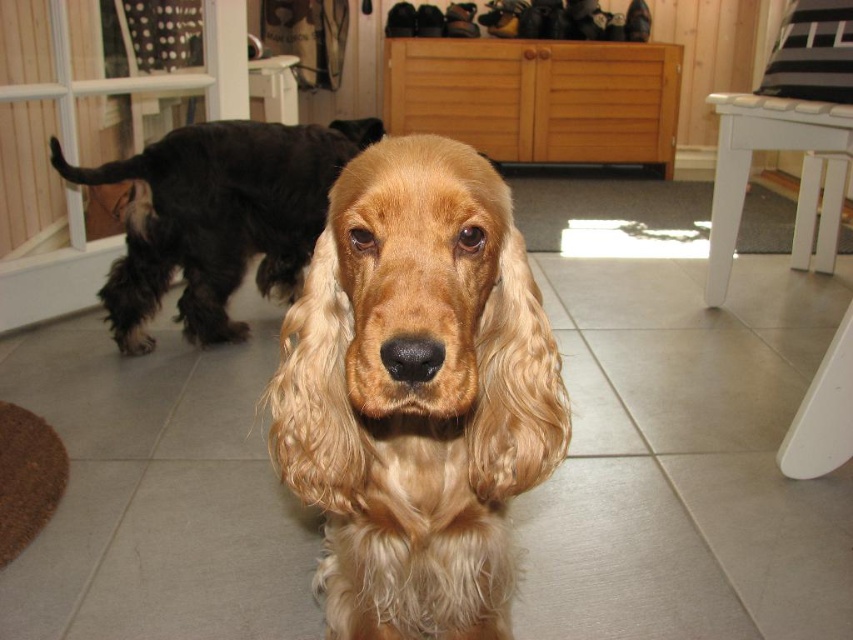
Is the position of golden fur dog at center more distant than that of black fuzzy dog at left?

No, golden fur dog at center is closer to the viewer.

Between point (399, 445) and point (204, 196), which one is positioned behind?

The point (204, 196) is more distant.

I want to click on golden fur dog at center, so click(x=416, y=394).